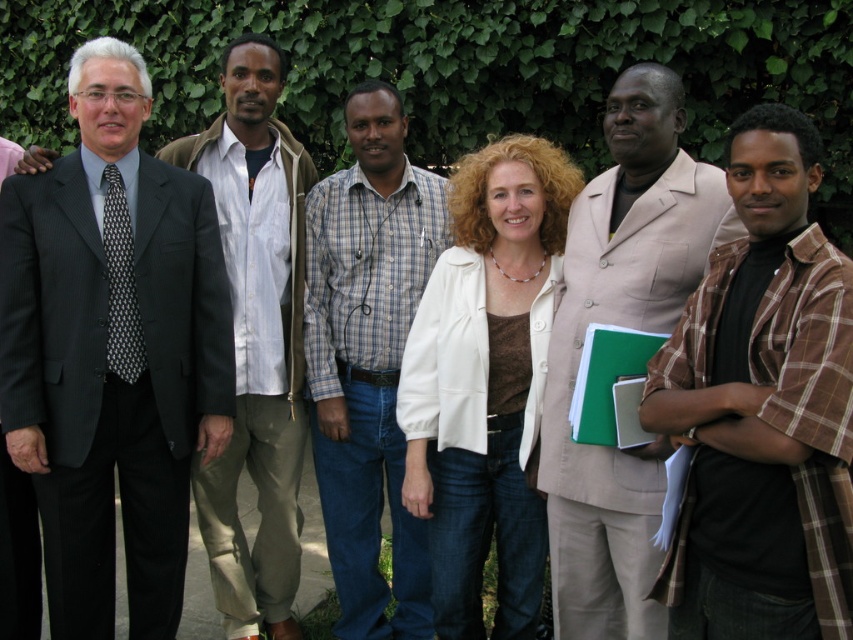
Question: Estimate the real-world distances between objects in this image. Which object is farther from the dark gray suit at left?

Choices:
 (A) white leather jacket at center
 (B) white shirt at center
 (C) plaid shirt at center
 (D) brown plaid shirt at center

Answer: (D)

Question: Is white leather jacket at center positioned before white shirt at center?

Choices:
 (A) yes
 (B) no

Answer: (A)

Question: Is dark gray suit at left bigger than brown plaid shirt at center?

Choices:
 (A) yes
 (B) no

Answer: (A)

Question: Which of the following is the closest to the observer?

Choices:
 (A) (248, 570)
 (B) (709, 244)
 (C) (741, 298)

Answer: (C)

Question: Which point is farther to the camera?

Choices:
 (A) white leather jacket at center
 (B) plaid shirt at center

Answer: (B)

Question: In this image, where is dark gray suit at left located relative to white shirt at center?

Choices:
 (A) below
 (B) above

Answer: (A)